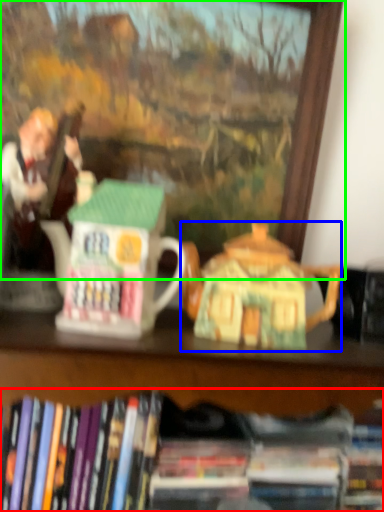
Question: Considering the real-world distances, which object is farthest from book (highlighted by a red box)? teapot (highlighted by a blue box) or picture frame (highlighted by a green box)?

Choices:
 (A) teapot
 (B) picture frame

Answer: (B)